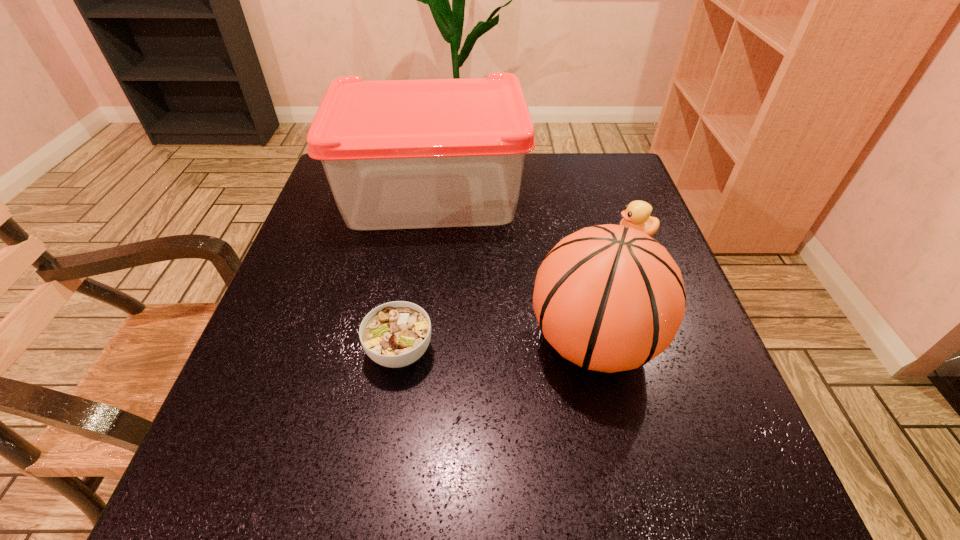
Locate an element on the screen. The image size is (960, 540). vacant region at the near right corner of the desktop is located at coordinates (676, 468).

Locate an element on the screen. The width and height of the screenshot is (960, 540). vacant space that's between the shortest object and the tray is located at coordinates (416, 273).

I want to click on free point between the tray and the basketball, so click(x=513, y=268).

Image resolution: width=960 pixels, height=540 pixels. In order to click on free space between the basketball and the tray in this screenshot , I will do `click(513, 268)`.

Locate an element on the screen. The height and width of the screenshot is (540, 960). free space between the duckling and the shortest object is located at coordinates (517, 293).

The height and width of the screenshot is (540, 960). What are the coordinates of `free space that is in between the soup bowl and the basketball` in the screenshot? It's located at (496, 347).

This screenshot has height=540, width=960. In order to click on vacant space in between the tray and the third tallest object in this screenshot , I will do point(534,214).

Image resolution: width=960 pixels, height=540 pixels. I want to click on empty space that is in between the tray and the third tallest object, so click(x=534, y=214).

Locate an element on the screen. The width and height of the screenshot is (960, 540). free point between the tray and the duckling is located at coordinates (534, 214).

The image size is (960, 540). What are the coordinates of `unoccupied position between the third tallest object and the shortest object` in the screenshot? It's located at (517, 293).